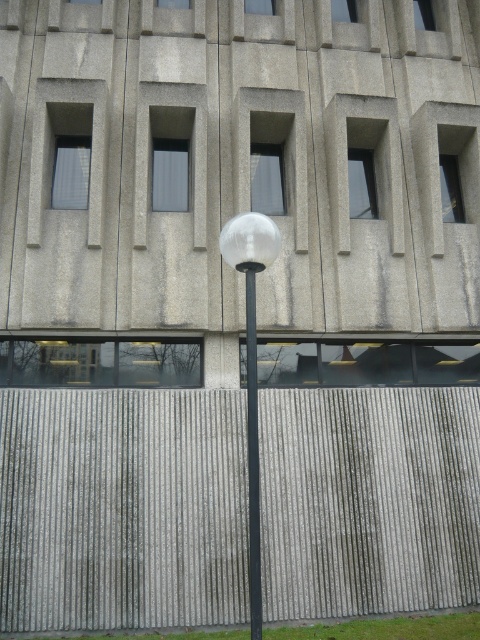
You are standing in front of the modern building facade and notice the transparent glass street light at center and the polished glass pole at center. Which object is closer to you?

The transparent glass street light at center is closer to you because it is in front of the polished glass pole at center.

You are a city planner assessing the lighting of the area. The transparent glass street light at center and the polished glass pole at center are both part of the new design. Which object will provide more illumination to the ground below?

The transparent glass street light at center is larger in size than the polished glass pole at center, so it will provide more illumination to the ground below.